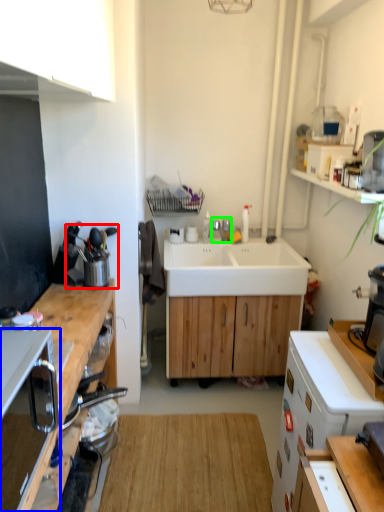
Question: Which object is the farthest from appliance (highlighted by a red box)? Choose among these: corded phone (highlighted by a blue box) or tap (highlighted by a green box).

Choices:
 (A) corded phone
 (B) tap

Answer: (A)